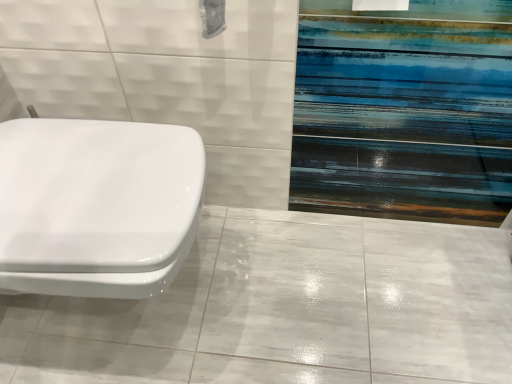
You are a GUI agent. You are given a task and a screenshot of the screen. Output one action in this format:
    pyautogui.click(x=<x>, y=<y>)
    Task: Click on the vacant space in white glossy toilet at left (from a real-world perspective)
    The width and height of the screenshot is (512, 384).
    Given the screenshot: What is the action you would take?
    pyautogui.click(x=142, y=315)